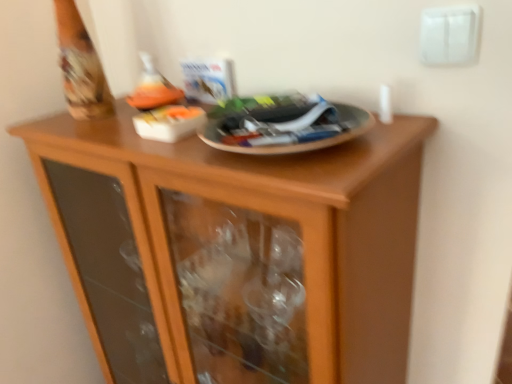
Identify the location of white plastic electric outlet at upper right. This screenshot has width=512, height=384. (449, 35).

What are the coordinates of `wooden cabinet at center` in the screenshot? It's located at (236, 251).

Describe the element at coordinates (153, 88) in the screenshot. I see `matte orange wine bottle at upper center` at that location.

The height and width of the screenshot is (384, 512). What are the coordinates of `white plastic electric outlet at upper right` in the screenshot? It's located at (449, 35).

This screenshot has height=384, width=512. What are the coordinates of `wine bottle below the white plastic electric outlet at upper right (from the image's perspective)` in the screenshot? It's located at (153, 88).

Considering the relative sizes of white plastic electric outlet at upper right and matte orange wine bottle at upper center in the image provided, is white plastic electric outlet at upper right thinner than matte orange wine bottle at upper center?

Yes.

Based on the photo, what's the angular difference between white plastic electric outlet at upper right and matte orange wine bottle at upper center's facing directions?

0.000412 degrees.

In the scene shown: From a real-world perspective, which object stands above the other?

white plastic electric outlet at upper right, from a real-world perspective.

Consider the image. Is wooden cabinet at center located within matte orange wine bottle at upper center?

That's incorrect, wooden cabinet at center is not inside matte orange wine bottle at upper center.

In terms of height, does matte orange wine bottle at upper center look taller or shorter compared to wooden cabinet at center?

Considering their sizes, matte orange wine bottle at upper center has less height than wooden cabinet at center.

From the picture: Who is smaller, matte orange wine bottle at upper center or wooden cabinet at center?

Smaller between the two is matte orange wine bottle at upper center.

Does point (152, 64) come closer to viewer compared to point (95, 159)?

That is False.

Which of these two, white plastic electric outlet at upper right or wooden cabinet at center, is bigger?

Bigger between the two is wooden cabinet at center.

In the scene shown: Can you tell me how much white plastic electric outlet at upper right and wooden cabinet at center differ in facing direction?

white plastic electric outlet at upper right and wooden cabinet at center are facing 0.000506 degrees away from each other.

Which object is positioned more to the left, white plastic electric outlet at upper right or wooden cabinet at center?

wooden cabinet at center is more to the left.

Is point (439, 39) in front of point (368, 377)?

Yes, it is.

Based on the photo, can we say matte orange wine bottle at upper center lies outside white plastic electric outlet at upper right?

Yes, matte orange wine bottle at upper center is not within white plastic electric outlet at upper right.

In terms of width, does matte orange wine bottle at upper center look wider or thinner when compared to white plastic electric outlet at upper right?

In the image, matte orange wine bottle at upper center appears to be wider than white plastic electric outlet at upper right.

Is point (132, 97) positioned in front of point (455, 54)?

No, it is not.

Is wooden cabinet at center further to the viewer compared to matte orange wine bottle at upper center?

No, wooden cabinet at center is closer to the camera.

Considering the sizes of objects wooden cabinet at center and matte orange wine bottle at upper center in the image provided, who is taller, wooden cabinet at center or matte orange wine bottle at upper center?

Standing taller between the two is wooden cabinet at center.

Considering the relative sizes of wooden cabinet at center and matte orange wine bottle at upper center in the image provided, is wooden cabinet at center bigger than matte orange wine bottle at upper center?

Yes.

Does wooden cabinet at center contain matte orange wine bottle at upper center?

No, matte orange wine bottle at upper center is located outside of wooden cabinet at center.

Is wooden cabinet at center at the right side of white plastic electric outlet at upper right?

Incorrect, wooden cabinet at center is not on the right side of white plastic electric outlet at upper right.

Is wooden cabinet at center next to white plastic electric outlet at upper right and touching it?

wooden cabinet at center and white plastic electric outlet at upper right are clearly separated.

The height and width of the screenshot is (384, 512). I want to click on electric outlet that appears behind the wooden cabinet at center, so click(x=449, y=35).

From a real-world perspective, relative to white plastic electric outlet at upper right, is wooden cabinet at center vertically above or below?

wooden cabinet at center is below white plastic electric outlet at upper right.

Where is `wine bottle lying below the white plastic electric outlet at upper right (from the image's perspective)`? Image resolution: width=512 pixels, height=384 pixels. wine bottle lying below the white plastic electric outlet at upper right (from the image's perspective) is located at coordinates (153, 88).

In the image, there is a matte orange wine bottle at upper center. Where is `cupboard below it (from a real-world perspective)`? cupboard below it (from a real-world perspective) is located at coordinates (236, 251).

From the image, which object appears to be farther from white plastic electric outlet at upper right, wooden cabinet at center or matte orange wine bottle at upper center?

wooden cabinet at center is positioned further to the anchor white plastic electric outlet at upper right.

Estimate the real-world distances between objects in this image. Which object is further from wooden cabinet at center, white plastic electric outlet at upper right or matte orange wine bottle at upper center?

Among the two, white plastic electric outlet at upper right is located further to wooden cabinet at center.

From the image, which object appears to be farther from wooden cabinet at center, matte orange wine bottle at upper center or white plastic electric outlet at upper right?

white plastic electric outlet at upper right lies further to wooden cabinet at center than the other object.

Looking at this image, based on their spatial positions, is white plastic electric outlet at upper right or wooden cabinet at center further from matte orange wine bottle at upper center?

white plastic electric outlet at upper right is further to matte orange wine bottle at upper center.

Considering their positions, is matte orange wine bottle at upper center positioned closer to white plastic electric outlet at upper right than wooden cabinet at center?

matte orange wine bottle at upper center is positioned closer to the anchor white plastic electric outlet at upper right.

In the scene shown: Based on their spatial positions, is wooden cabinet at center or white plastic electric outlet at upper right closer to matte orange wine bottle at upper center?

The object closer to matte orange wine bottle at upper center is wooden cabinet at center.

Locate an element on the screen. wine bottle between white plastic electric outlet at upper right and wooden cabinet at center vertically is located at coordinates (153, 88).